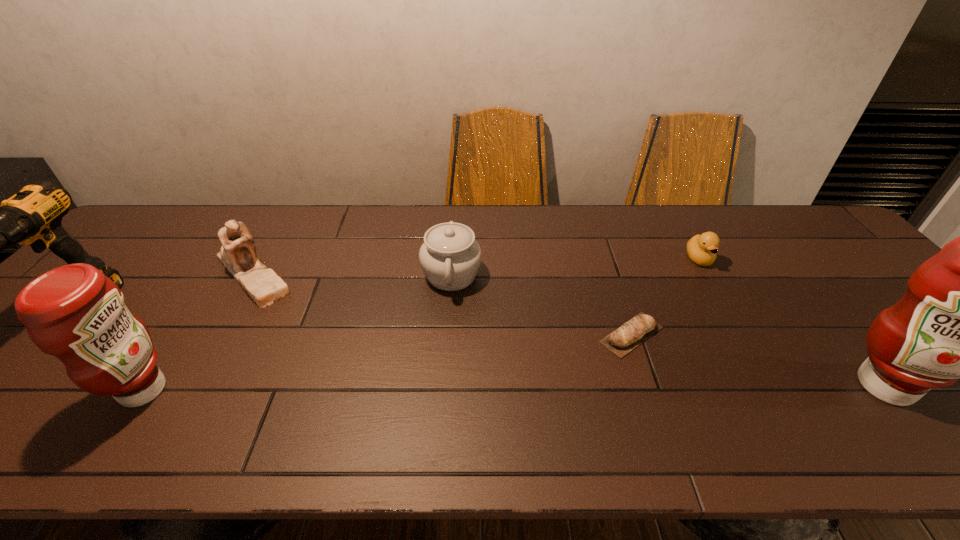
Locate an element on the screen. The image size is (960, 540). object that is at the left edge is located at coordinates (33, 216).

The width and height of the screenshot is (960, 540). In order to click on object present at the right edge in this screenshot , I will do `click(959, 318)`.

Where is `object located at the near right corner`? The image size is (960, 540). object located at the near right corner is located at coordinates (959, 318).

Where is `blank area at the far edge`? blank area at the far edge is located at coordinates (339, 240).

You are a GUI agent. You are given a task and a screenshot of the screen. Output one action in this format:
    pyautogui.click(x=<x>, y=<y>)
    Task: Click on the vacant area at the near edge of the desktop
    The image size is (960, 540).
    Given the screenshot: What is the action you would take?
    pyautogui.click(x=805, y=410)

Find the location of `vacant region at the left edge of the desktop`. vacant region at the left edge of the desktop is located at coordinates (121, 256).

The image size is (960, 540). What are the coordinates of `vacant space at the far left corner` in the screenshot? It's located at (147, 225).

In order to click on empty space between the pita bread and the chinaware in this screenshot , I will do `click(541, 305)`.

The image size is (960, 540). Find the location of `vacant region between the left condiment and the figurine`. vacant region between the left condiment and the figurine is located at coordinates (199, 332).

I want to click on vacant space that's between the second shortest object and the shorter condiment, so click(x=421, y=325).